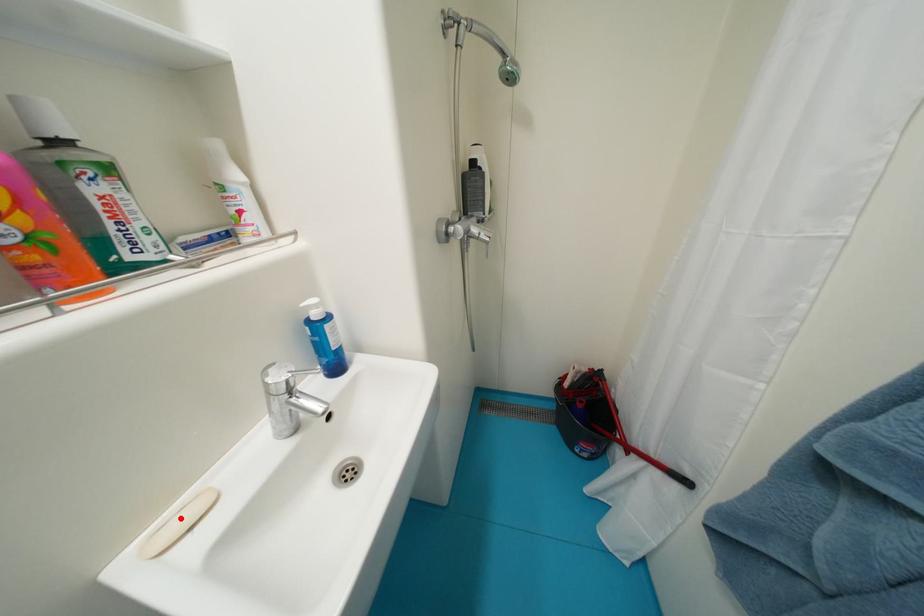
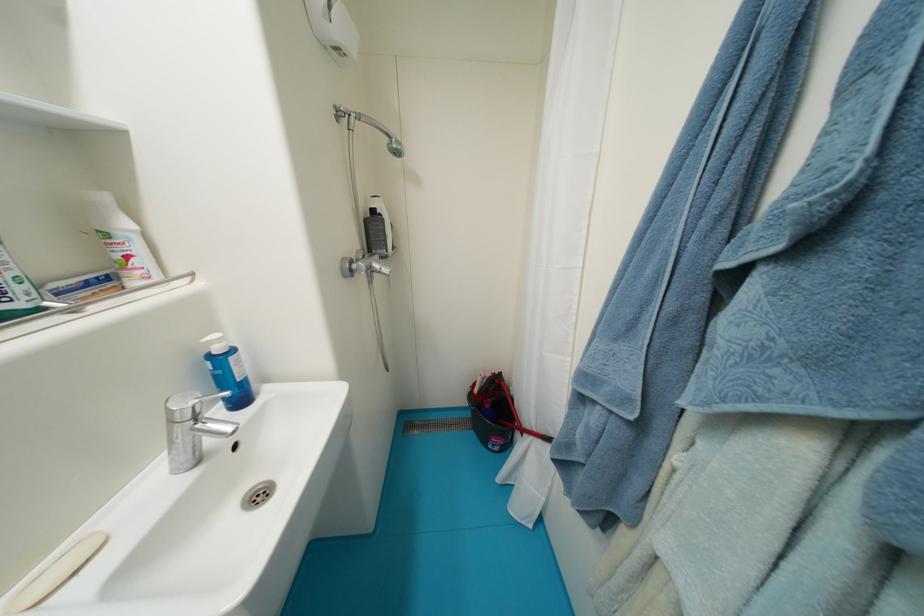
In the second image, find the point that corresponds to the highlighted location in the first image.

(55, 572)